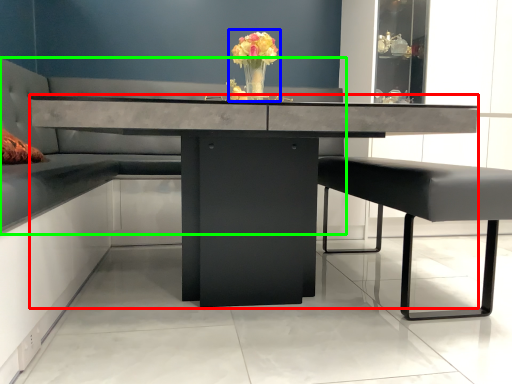
Question: Which object is positioned farthest from table (highlighted by a red box)? Select from floral arrangement (highlighted by a blue box) and couch (highlighted by a green box).

Choices:
 (A) floral arrangement
 (B) couch

Answer: (B)